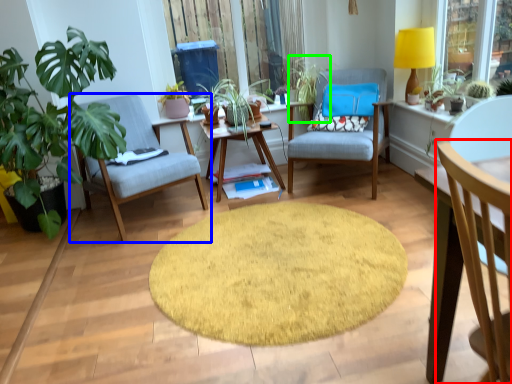
Question: Which object is positioned closest to chair (highlighted by a red box)? Select from chair (highlighted by a blue box) and vegetation (highlighted by a green box).

Choices:
 (A) chair
 (B) vegetation

Answer: (A)